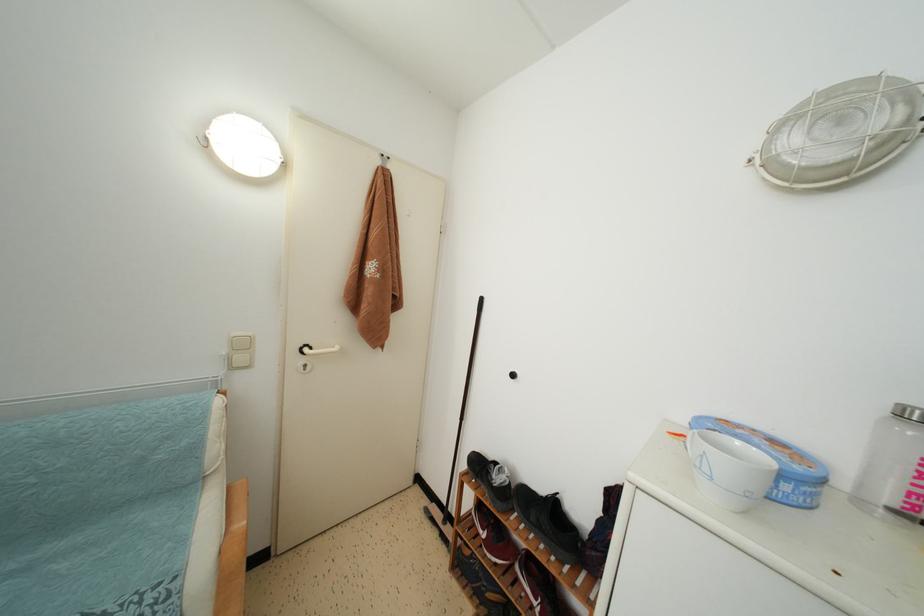
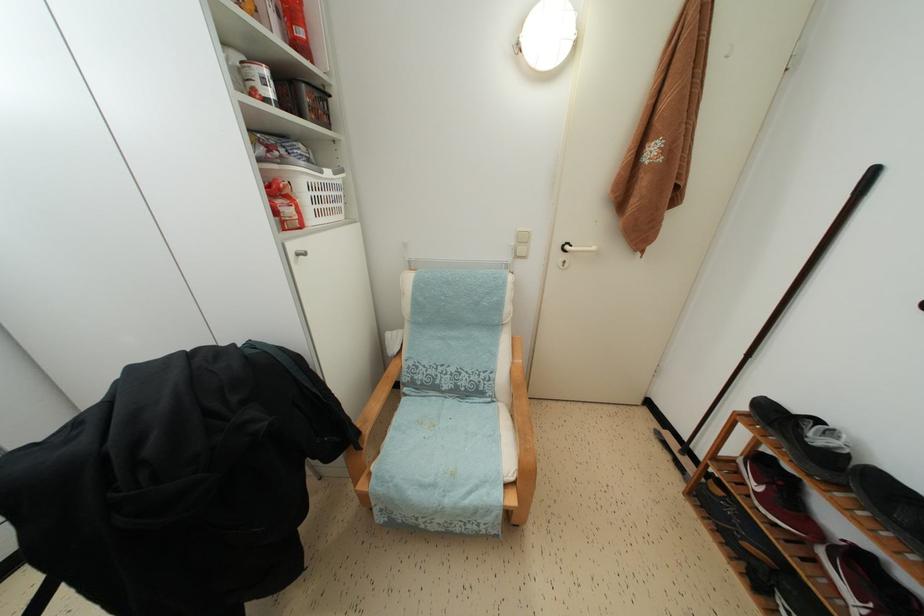
Find the pixel in the second image that matches pixel 488 540 in the first image.

(760, 493)